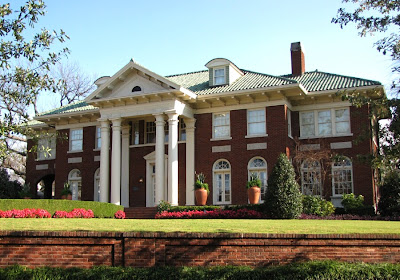
Where is `3 windows on second floor right side`? Image resolution: width=400 pixels, height=280 pixels. 3 windows on second floor right side is located at coordinates (230, 116), (260, 125), (316, 127).